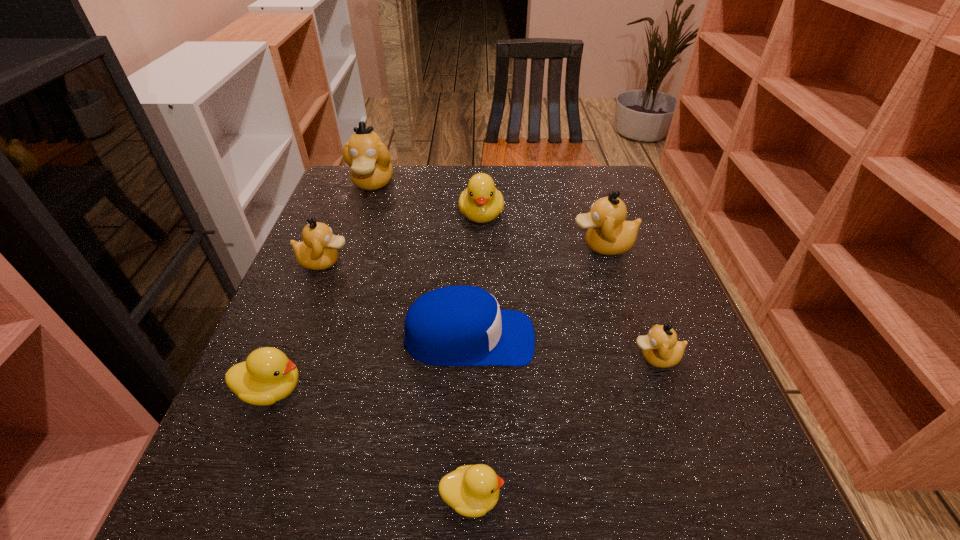
Identify the location of duckling that is the third closest to the third biggest tan duckling. (481, 202).

Locate which duckling is the sixth closest to the farthest tan duckling. Please provide its 2D coordinates. Your answer should be formatted as a tuple, i.e. [(x, y)], where the tuple contains the x and y coordinates of a point satisfying the conditions above.

[(471, 490)]

I want to click on tan duckling that can be found as the closest to the nearest tan duckling, so click(x=608, y=233).

Locate which tan duckling ranks third in proximity to the leftmost yellow duckling. Please provide its 2D coordinates. Your answer should be formatted as a tuple, i.e. [(x, y)], where the tuple contains the x and y coordinates of a point satisfying the conditions above.

[(661, 349)]

Find the location of `yellow duckling that stands as the closest to the biggest yellow duckling`. yellow duckling that stands as the closest to the biggest yellow duckling is located at coordinates (267, 376).

Choose which yellow duckling is the second nearest neighbor to the farthest yellow duckling. Please provide its 2D coordinates. Your answer should be formatted as a tuple, i.e. [(x, y)], where the tuple contains the x and y coordinates of a point satisfying the conditions above.

[(471, 490)]

Identify the location of free space in the image that satisfies the following two spatial constraints: 1. on the beak of the biggest yellow duckling; 2. on the face of the third biggest tan duckling. This screenshot has height=540, width=960. (482, 262).

Find the location of a particular element. blank space that satisfies the following two spatial constraints: 1. on the beak of the farthest yellow duckling; 2. on the face of the second smallest tan duckling is located at coordinates (482, 262).